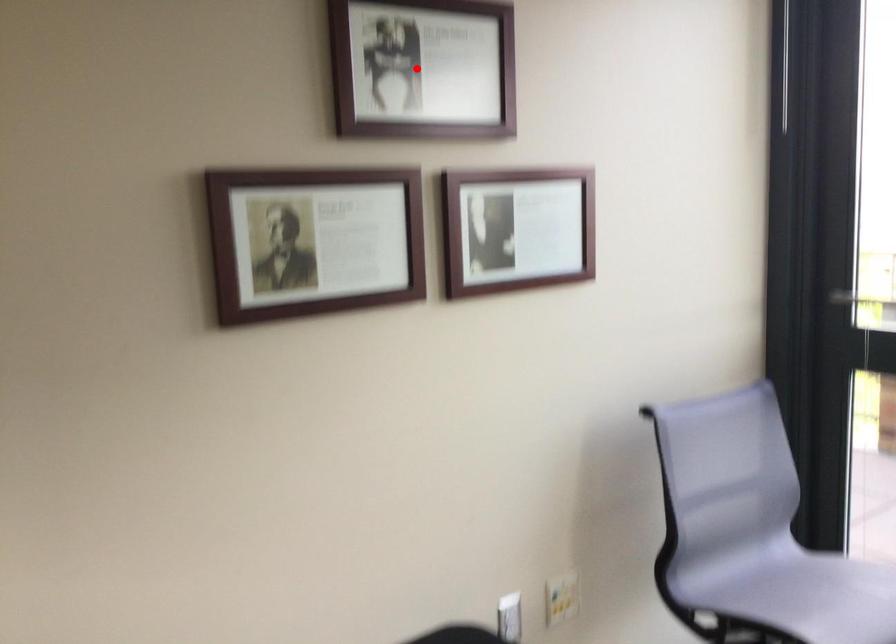
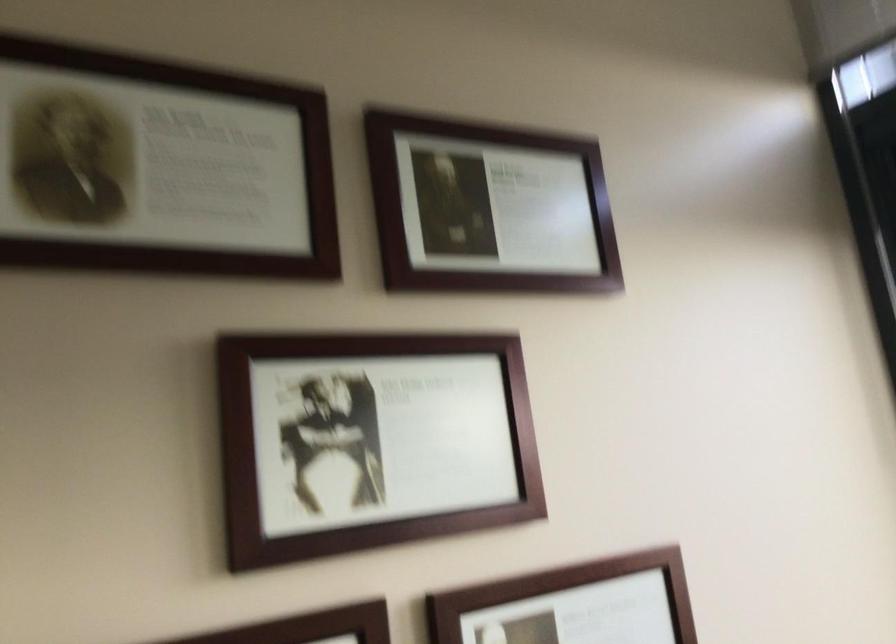
The point at the highlighted location is marked in the first image. Where is the corresponding point in the second image?

(373, 439)